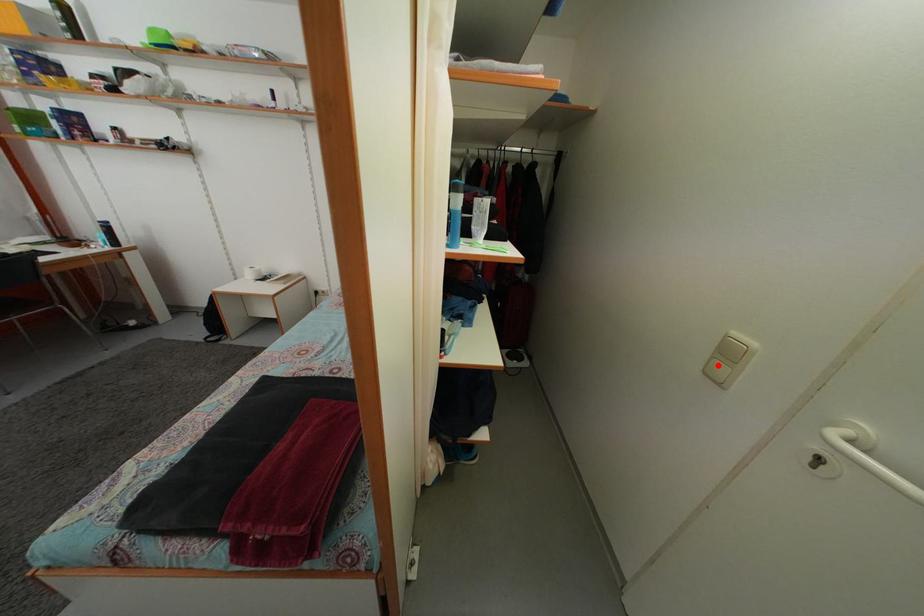
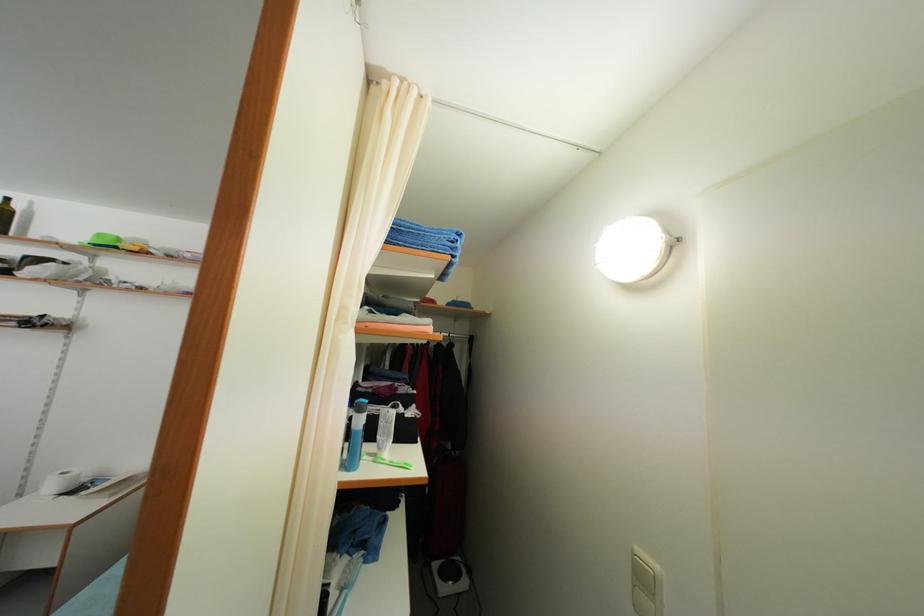
In the second image, find the point that corresponds to the highlighted location in the first image.

(639, 593)